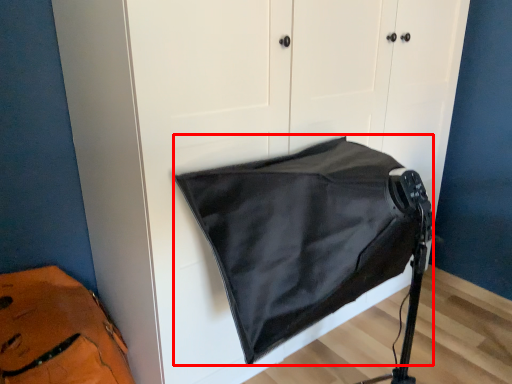
Question: From the image, what is the correct spatial relationship of sleeping bag (annotated by the red box) in relation to messenger bag?

Choices:
 (A) right
 (B) left

Answer: (A)